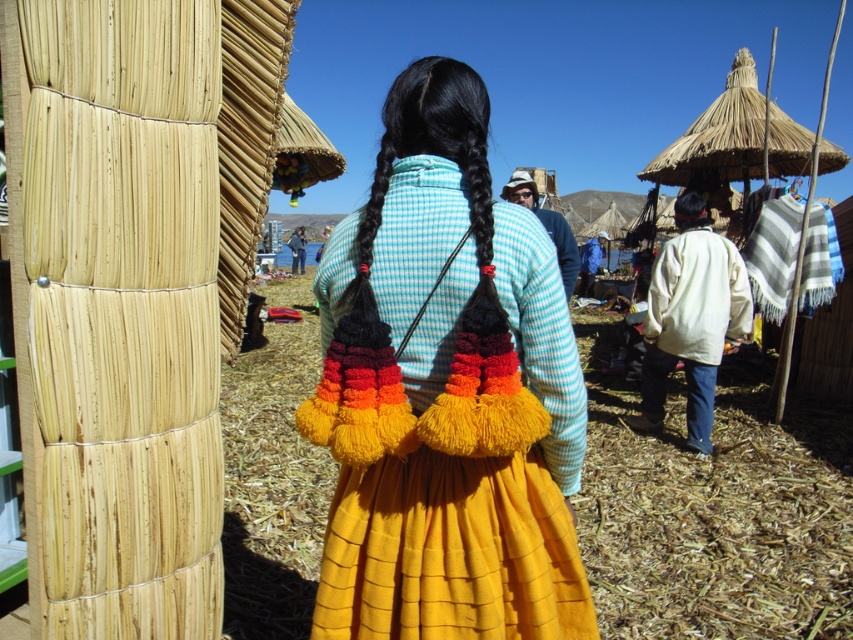
Question: Does yarn pom-pom bag at center have a greater width compared to white woolen jacket at center?

Choices:
 (A) yes
 (B) no

Answer: (B)

Question: Which of the following is the closest to the observer?

Choices:
 (A) (645, 344)
 (B) (341, 410)

Answer: (B)

Question: Is the position of yarn pom-pom bag at center more distant than that of white woolen jacket at center?

Choices:
 (A) no
 (B) yes

Answer: (A)

Question: Observing the image, what is the correct spatial positioning of yarn pom-pom bag at center in reference to white woolen jacket at center?

Choices:
 (A) below
 (B) above

Answer: (A)

Question: Among these objects, which one is farthest from the camera?

Choices:
 (A) yarn pom-pom bag at center
 (B) white woolen jacket at center

Answer: (B)

Question: Among these objects, which one is nearest to the camera?

Choices:
 (A) yarn pom-pom bag at center
 (B) white woolen jacket at center

Answer: (A)